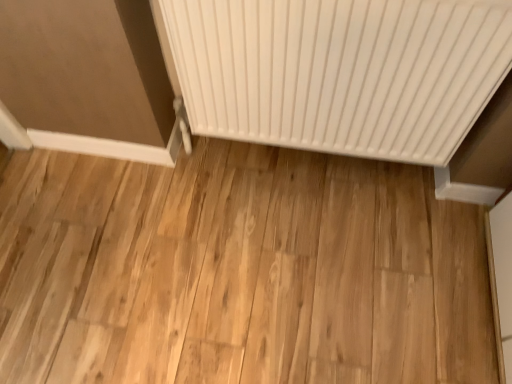
Question: Should I look upward or downward to see white ribbed radiator at center?

Choices:
 (A) up
 (B) down

Answer: (A)